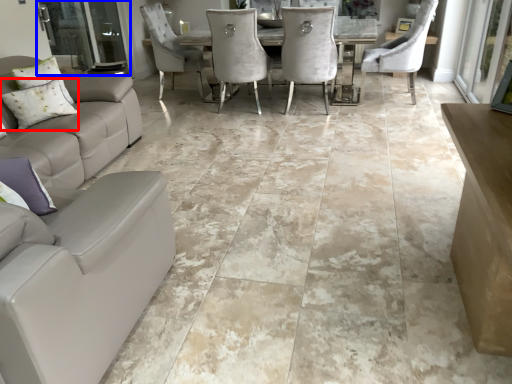
Question: Which object is further to the camera taking this photo, pillow (highlighted by a red box) or screen door (highlighted by a blue box)?

Choices:
 (A) pillow
 (B) screen door

Answer: (B)